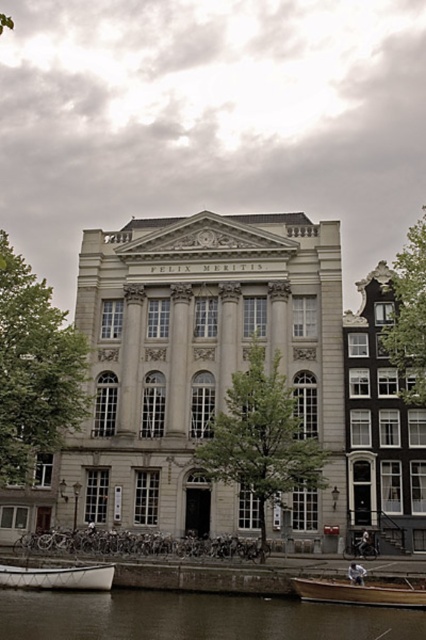
Question: Which point is closer to the camera taking this photo?

Choices:
 (A) (5, 394)
 (B) (209, 472)
 (C) (296, 589)
 (D) (409, 369)

Answer: (C)

Question: Is green leafy tree at left smaller than wooden boat at lower right?

Choices:
 (A) yes
 (B) no

Answer: (B)

Question: From the image, what is the correct spatial relationship of green leafy tree at left in relation to green leafy tree at upper right?

Choices:
 (A) left
 (B) right

Answer: (A)

Question: Which of these objects is positioned farthest from the brown wooden boat at lower center?

Choices:
 (A) green leafy tree at left
 (B) green leafy tree at upper right

Answer: (B)

Question: Which object is the farthest from the green leafy tree at upper right?

Choices:
 (A) green leafy tree at left
 (B) green leafy tree at center
 (C) brown wooden boat at lower center
 (D) wooden boat at lower right

Answer: (A)

Question: Is green leafy tree at left closer to the viewer compared to green leafy tree at upper right?

Choices:
 (A) no
 (B) yes

Answer: (B)